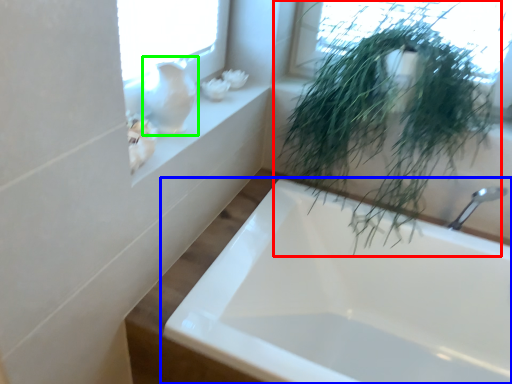
Question: Estimate the real-world distances between objects in this image. Which object is farther from houseplant (highlighted by a red box), bathtub (highlighted by a blue box) or glass vase (highlighted by a green box)?

Choices:
 (A) bathtub
 (B) glass vase

Answer: (B)